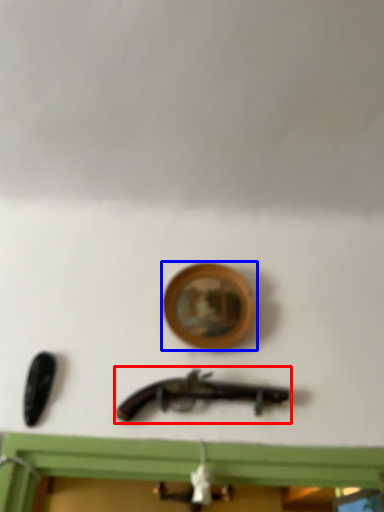
Question: Which point is further to the camera, weapon (highlighted by a red box) or picture frame (highlighted by a blue box)?

Choices:
 (A) weapon
 (B) picture frame

Answer: (B)